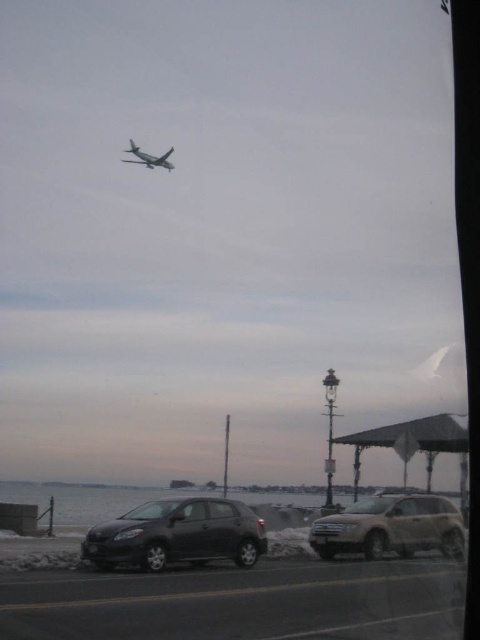
Question: Which is farther from the silver metallic airplane at upper center?

Choices:
 (A) matte black car at lower center
 (B) beige matte suv at lower right

Answer: (A)

Question: Is matte black car at lower center closer to camera compared to silver metallic airplane at upper center?

Choices:
 (A) no
 (B) yes

Answer: (B)

Question: Is matte black car at lower center positioned behind beige matte suv at lower right?

Choices:
 (A) yes
 (B) no

Answer: (B)

Question: Which is farther from the silver metallic airplane at upper center?

Choices:
 (A) matte black car at lower center
 (B) beige matte suv at lower right

Answer: (A)

Question: Estimate the real-world distances between objects in this image. Which object is farther from the beige matte suv at lower right?

Choices:
 (A) matte black car at lower center
 (B) silver metallic airplane at upper center

Answer: (B)

Question: Does beige matte suv at lower right appear over silver metallic airplane at upper center?

Choices:
 (A) no
 (B) yes

Answer: (A)